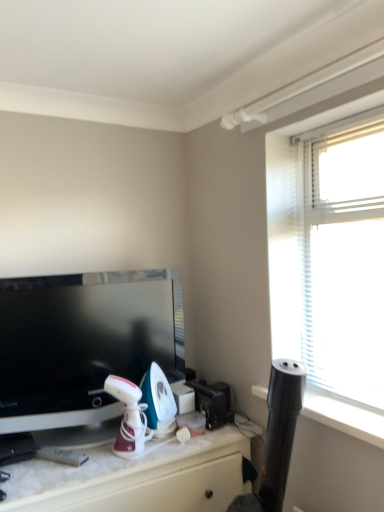
Question: Can you confirm if white marble desk at lower center is positioned to the left of black glossy television at left?

Choices:
 (A) no
 (B) yes

Answer: (A)

Question: Is white marble desk at lower center surrounding black glossy television at left?

Choices:
 (A) yes
 (B) no

Answer: (B)

Question: Does white marble desk at lower center have a greater width compared to black glossy television at left?

Choices:
 (A) no
 (B) yes

Answer: (B)

Question: Does white marble desk at lower center appear on the right side of black glossy television at left?

Choices:
 (A) yes
 (B) no

Answer: (A)

Question: Can you confirm if white marble desk at lower center is thinner than black glossy television at left?

Choices:
 (A) yes
 (B) no

Answer: (B)

Question: From the image's perspective, is white marble desk at lower center below black glossy television at left?

Choices:
 (A) yes
 (B) no

Answer: (A)

Question: Can you confirm if black glossy television at left is bigger than white marble desk at lower center?

Choices:
 (A) yes
 (B) no

Answer: (B)

Question: Considering the relative positions of black glossy television at left and white marble desk at lower center in the image provided, is black glossy television at left to the right of white marble desk at lower center from the viewer's perspective?

Choices:
 (A) no
 (B) yes

Answer: (A)

Question: Is black glossy television at left wider than white marble desk at lower center?

Choices:
 (A) yes
 (B) no

Answer: (B)

Question: Does black glossy television at left appear on the left side of white marble desk at lower center?

Choices:
 (A) yes
 (B) no

Answer: (A)

Question: Considering the relative sizes of black glossy television at left and white marble desk at lower center in the image provided, is black glossy television at left smaller than white marble desk at lower center?

Choices:
 (A) yes
 (B) no

Answer: (A)

Question: Can you confirm if black glossy television at left is shorter than white marble desk at lower center?

Choices:
 (A) yes
 (B) no

Answer: (B)

Question: Considering the positions of point (46, 490) and point (97, 354), is point (46, 490) closer or farther from the camera than point (97, 354)?

Choices:
 (A) farther
 (B) closer

Answer: (B)